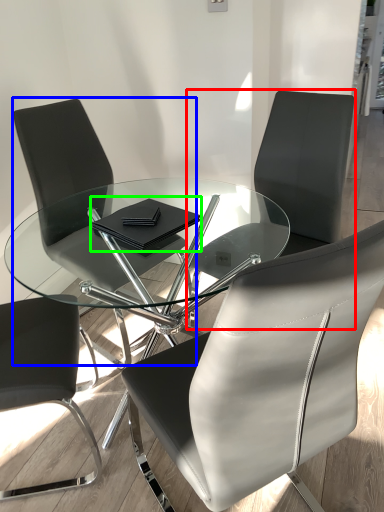
Question: Considering the real-world distances, which object is farthest from chair (highlighted by a red box)? chair (highlighted by a blue box) or notebook (highlighted by a green box)?

Choices:
 (A) chair
 (B) notebook

Answer: (A)